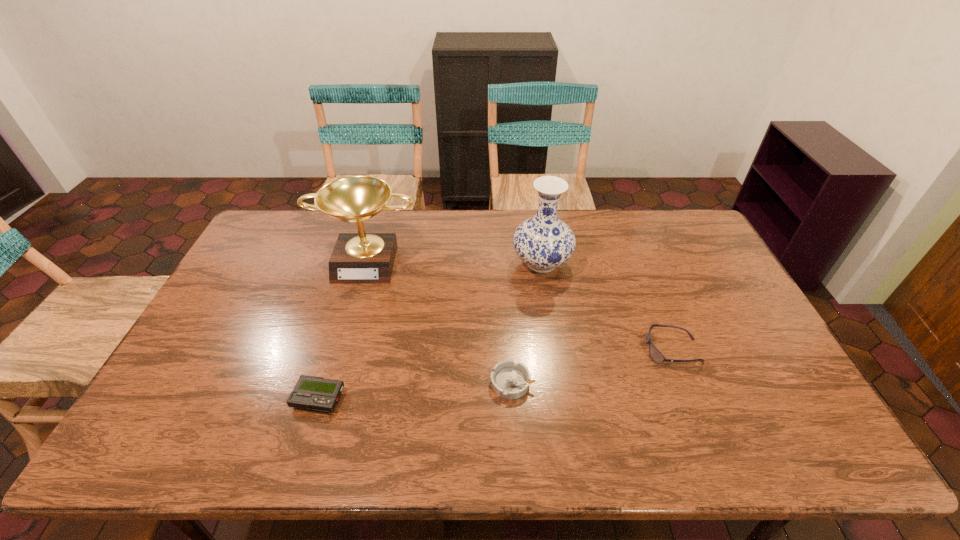
This screenshot has height=540, width=960. Find the location of `vase`. vase is located at coordinates (543, 242).

Find the location of a particular element. award is located at coordinates (358, 258).

Identify the location of the third tallest object. Image resolution: width=960 pixels, height=540 pixels. (654, 353).

Locate an element on the screen. Image resolution: width=960 pixels, height=540 pixels. the rightmost object is located at coordinates (654, 353).

Identify the location of beeper. The width and height of the screenshot is (960, 540). (313, 393).

Locate an element on the screen. The width and height of the screenshot is (960, 540). ashtray is located at coordinates (509, 380).

Locate an element on the screen. This screenshot has height=540, width=960. free space located on the left of the vase is located at coordinates (443, 263).

Locate an element on the screen. This screenshot has height=540, width=960. vacant region located 0.370m on the front-facing side of the award is located at coordinates (333, 382).

Identify the location of vacant space located 0.310m on the lenses of the sunglasses. This screenshot has height=540, width=960. (534, 350).

Image resolution: width=960 pixels, height=540 pixels. I want to click on free spot located on the lenses of the sunglasses, so click(x=628, y=350).